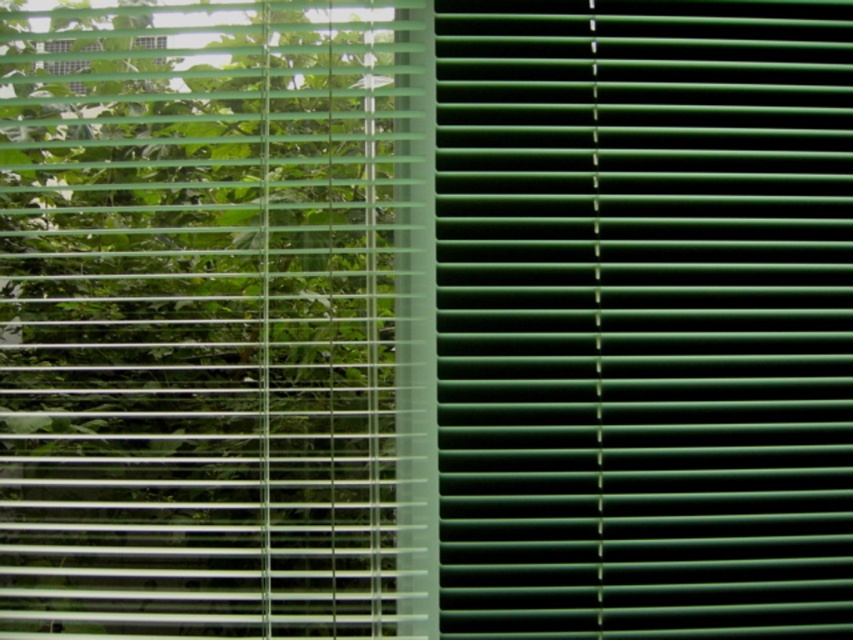
Does green plastic blinds at right have a larger size compared to green matte blinds at left?

No.

Does green plastic blinds at right appear over green matte blinds at left?

Correct, green plastic blinds at right is located above green matte blinds at left.

Is point (537, 16) farther from viewer compared to point (316, 236)?

No, (537, 16) is in front of (316, 236).

At what (x,y) coordinates should I click in order to perform the action: click on green plastic blinds at right. Please return your answer as a coordinate pair (x, y). The image size is (853, 640). Looking at the image, I should click on (642, 317).